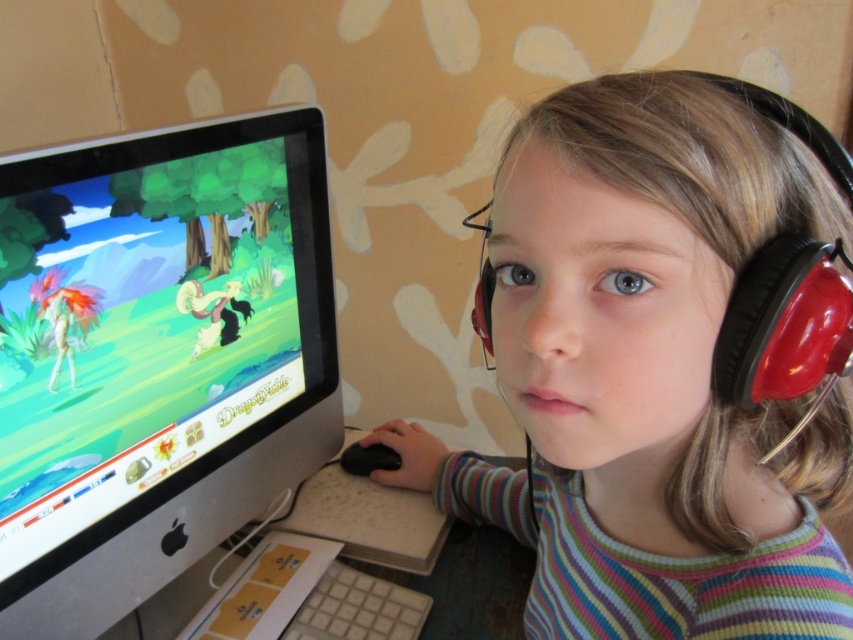
You are a visitor in the room and want to take a photo of the black matte headphones at upper right without blocking the satin black monitor at left. Is it possible to position yourself in a way that allows you to capture the headphones while keeping the monitor out of the frame?

The black matte headphones at upper right is located below the satin black monitor at left, so if you position yourself below the monitor and aim upwards, you can capture the headphones while keeping the monitor out of the frame.

You are setting up a desk for a child. You have a black matte headphones at upper right and a satin black monitor at left. Which object should you place closer to the edge of the desk to save space?

The black matte headphones at upper right should be placed closer to the edge of the desk since it is not as tall as the satin black monitor at left, allowing for better space management.